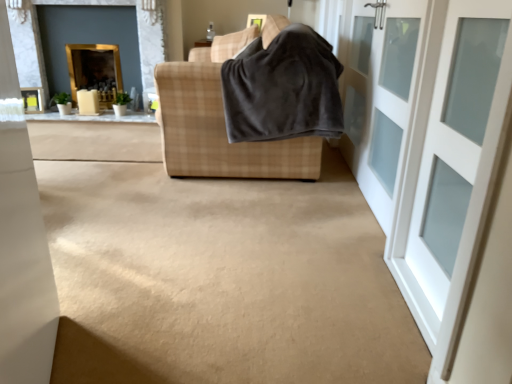
Question: In the image, is gold-framed mirror at upper left, the 2th fireplace when ordered from right to left, positioned in front of or behind plaid fabric sofa at center?

Choices:
 (A) behind
 (B) front

Answer: (A)

Question: Is gold-framed mirror at upper left, the 1th fireplace viewed from the left, taller or shorter than plaid fabric sofa at center?

Choices:
 (A) tall
 (B) short

Answer: (B)

Question: Which object is the closest to the gold-framed mirror at upper left, the 2th fireplace when ordered from right to left?

Choices:
 (A) gold-framed mirror at upper left, which is the first fireplace in right-to-left order
 (B) dark gray fleece blanket at center
 (C) white glass door at right, arranged as the 1th door when viewed from the front
 (D) white glass door at right, which appears as the second door when viewed from the front
 (E) plaid fabric sofa at center

Answer: (A)

Question: Which of these objects is positioned farthest from the white glass door at right, arranged as the 1th door when viewed from the front?

Choices:
 (A) gold-framed mirror at upper left, which is the first fireplace in right-to-left order
 (B) plaid fabric sofa at center
 (C) dark gray fleece blanket at center
 (D) gold-framed mirror at upper left, the 2th fireplace when ordered from right to left
 (E) white glass door at right, marked as the 1th door in a back-to-front arrangement

Answer: (D)